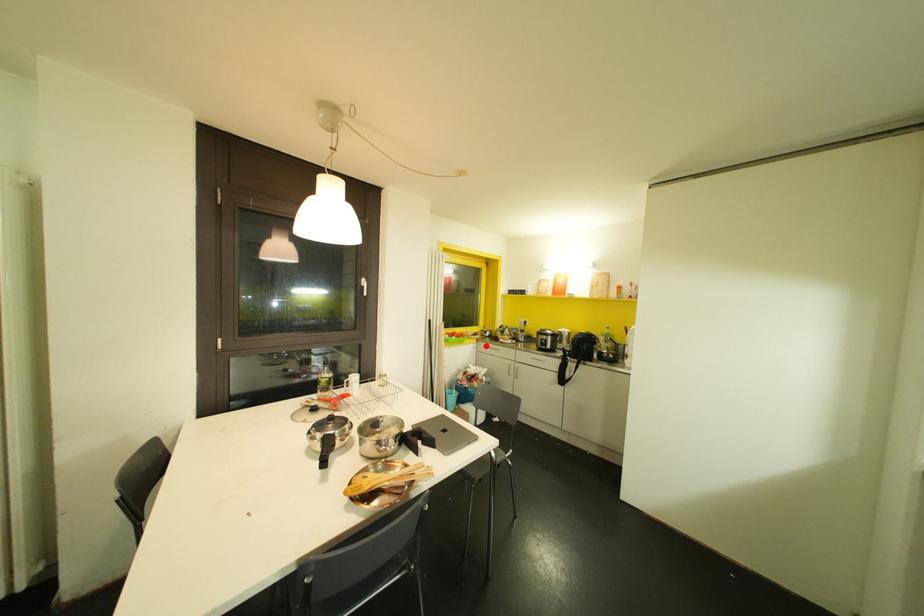
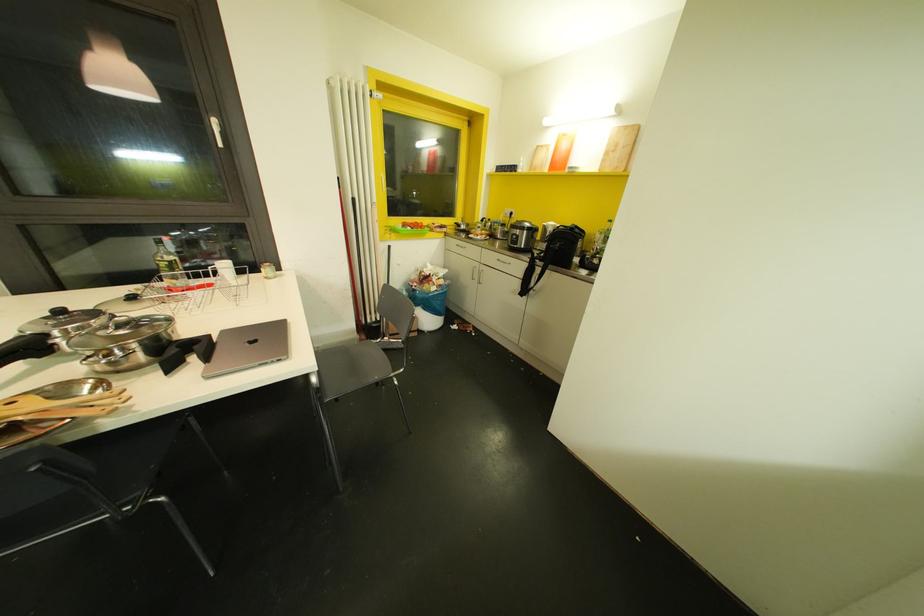
Question: I am providing you with two images of the same scene from different viewpoints. Given a red point in image1, look at the same physical point in image2. Is it:

Choices:
 (A) Closer to the viewpoint
 (B) Farther from the viewpoint

Answer: (A)